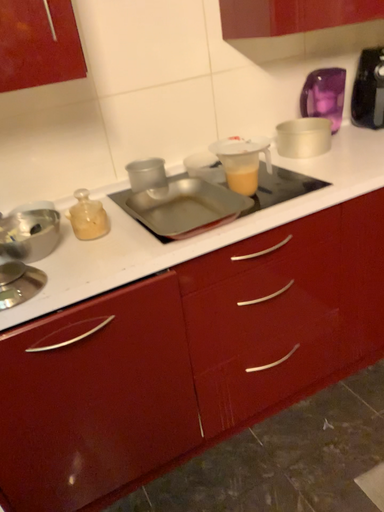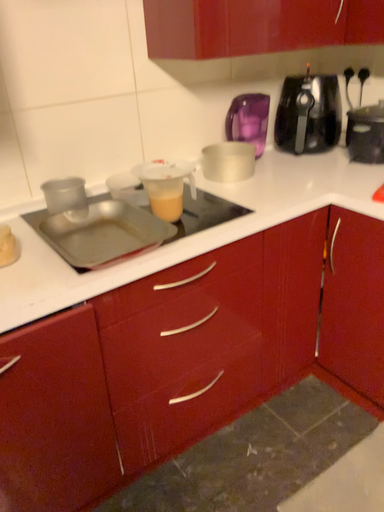
Question: How did the camera likely rotate when shooting the video?

Choices:
 (A) rotated right
 (B) rotated left

Answer: (A)